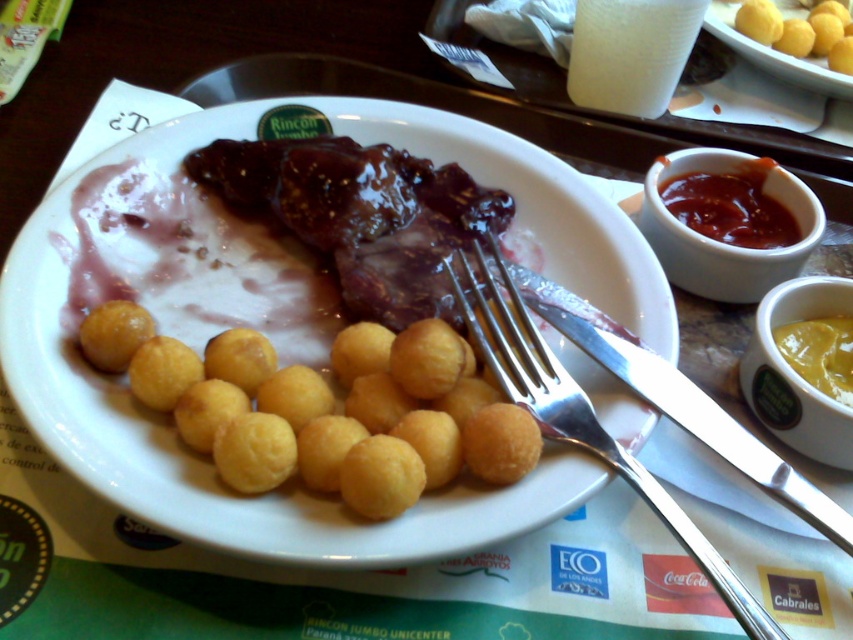
Question: Which of the following is the closest to the observer?

Choices:
 (A) white paper cup at upper center
 (B) yellow matte balls at upper right
 (C) smooth matte ketchup at upper right

Answer: (C)

Question: Where is silver metallic fork at upper center located in relation to white paper cup at upper center in the image?

Choices:
 (A) below
 (B) above

Answer: (A)

Question: Considering the real-world distances, which object is closest to the yellow matte balls at upper right?

Choices:
 (A) silver metallic fork at upper center
 (B) smooth matte ketchup at upper right
 (C) white paper cup at upper center
 (D) golden fried balls at center

Answer: (C)

Question: Does golden fried balls at center have a smaller size compared to smooth matte ketchup at upper right?

Choices:
 (A) yes
 (B) no

Answer: (B)

Question: Does smooth matte ketchup at upper right appear on the right side of yellow creamy sauce at upper right?

Choices:
 (A) no
 (B) yes

Answer: (A)

Question: Which of the following is the closest to the observer?

Choices:
 (A) 611,100
 (B) 520,298
 (C) 239,236

Answer: (B)